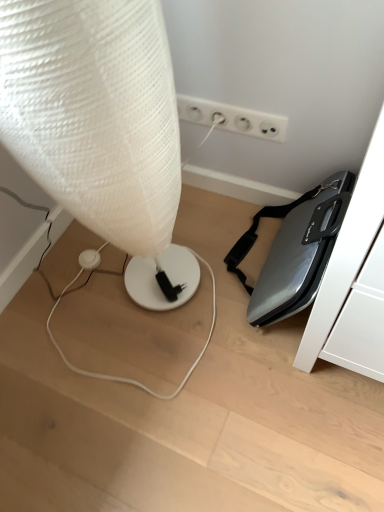
In order to click on free space to the left of white textured lamp at left in this screenshot , I will do click(55, 311).